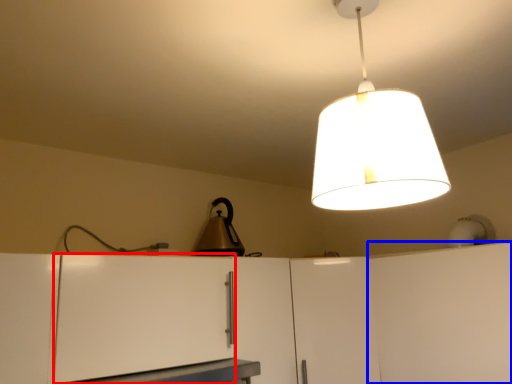
Question: Which of the following is the farthest to the observer, cabinetry (highlighted by a red box) or cabinetry (highlighted by a blue box)?

Choices:
 (A) cabinetry
 (B) cabinetry

Answer: (B)